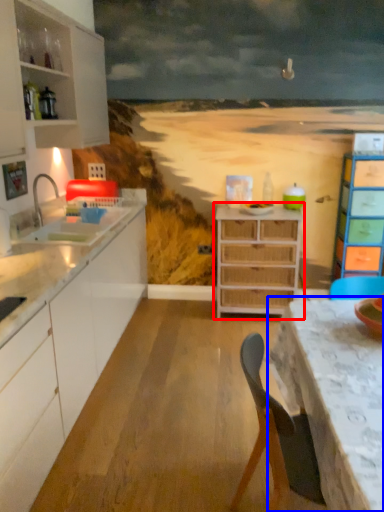
Question: Which of the following is the farthest to the observer, chest of drawers (highlighted by a red box) or table (highlighted by a blue box)?

Choices:
 (A) chest of drawers
 (B) table

Answer: (A)